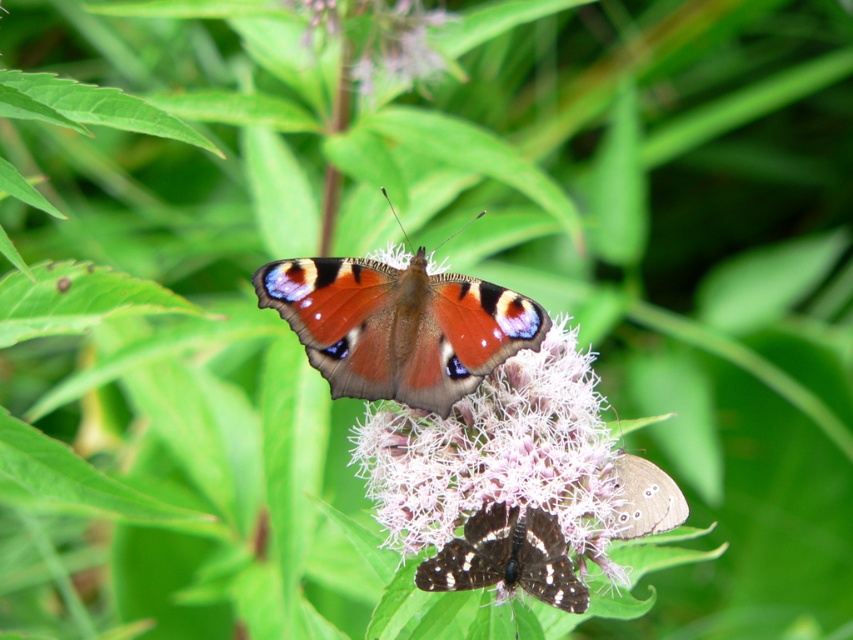
Question: Estimate the real-world distances between objects in this image. Which object is farther from the shiny orange butterfly at center?

Choices:
 (A) pink fluffy flower at center
 (B) shiny brown butterfly at center
 (C) brown speckled butterfly at lower right

Answer: (C)

Question: Is shiny brown butterfly at center smaller than brown speckled butterfly at lower right?

Choices:
 (A) yes
 (B) no

Answer: (B)

Question: Which is nearer to the shiny orange butterfly at center?

Choices:
 (A) shiny brown butterfly at center
 (B) brown speckled butterfly at lower right

Answer: (A)

Question: Which object appears farthest from the camera in this image?

Choices:
 (A) shiny orange butterfly at center
 (B) pink fluffy flower at center

Answer: (B)

Question: Does pink fluffy flower at center have a larger size compared to brown speckled butterfly at lower right?

Choices:
 (A) yes
 (B) no

Answer: (A)

Question: Does shiny orange butterfly at center have a larger size compared to shiny brown butterfly at center?

Choices:
 (A) yes
 (B) no

Answer: (A)